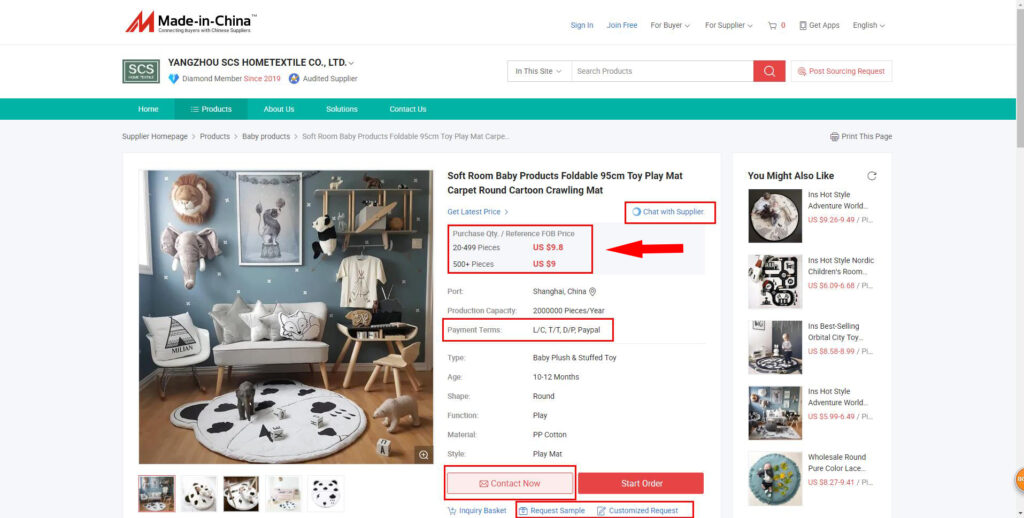
Find the location of a particular element. Image resolution: width=1024 pixels, height=518 pixels. display shelf is located at coordinates (389, 230).